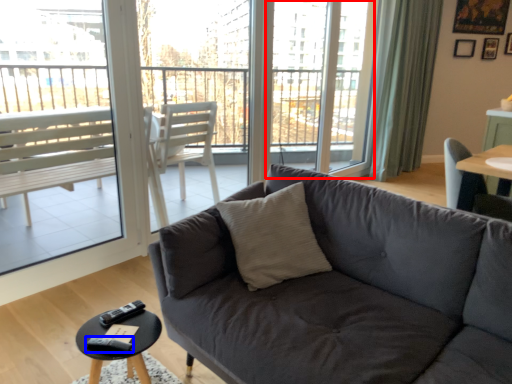
Question: Which point is closer to the camera, screen door (highlighted by a red box) or remote (highlighted by a blue box)?

Choices:
 (A) screen door
 (B) remote

Answer: (B)